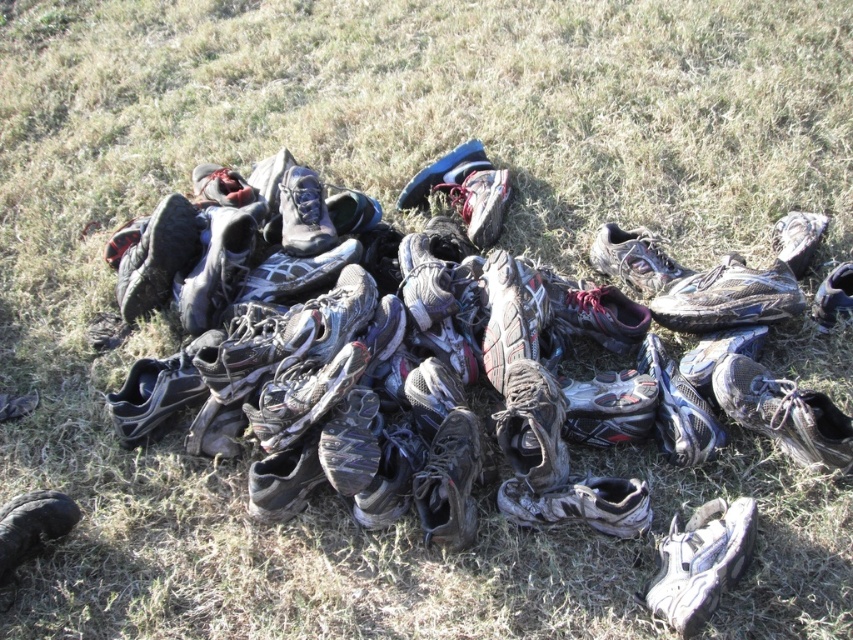
Which of these two, shiny gray shoe at lower right or shiny black shoe at lower right, stands taller?

shiny black shoe at lower right

Does shiny gray shoe at lower right appear on the right side of shiny black shoe at lower right?

In fact, shiny gray shoe at lower right is to the left of shiny black shoe at lower right.

What are the coordinates of `shiny gray shoe at lower right` in the screenshot? It's located at (701, 561).

The width and height of the screenshot is (853, 640). What are the coordinates of `shiny gray shoe at lower right` in the screenshot? It's located at (701, 561).

Between matte gray shoe at center and black leather shoe at lower left, which one is positioned lower?

black leather shoe at lower left is below.

Can you confirm if matte gray shoe at center is positioned to the right of black leather shoe at lower left?

Correct, you'll find matte gray shoe at center to the right of black leather shoe at lower left.

This screenshot has height=640, width=853. Describe the element at coordinates (579, 504) in the screenshot. I see `matte gray shoe at center` at that location.

Locate an element on the screen. The image size is (853, 640). matte gray shoe at center is located at coordinates coord(579,504).

What do you see at coordinates (701, 561) in the screenshot? This screenshot has width=853, height=640. I see `shiny gray shoe at lower right` at bounding box center [701, 561].

Which is in front, point (705, 566) or point (688, 320)?

Point (705, 566) is more forward.

I want to click on shiny gray shoe at lower right, so click(x=701, y=561).

Where is `shiny gray shoe at lower right`? The height and width of the screenshot is (640, 853). shiny gray shoe at lower right is located at coordinates (701, 561).